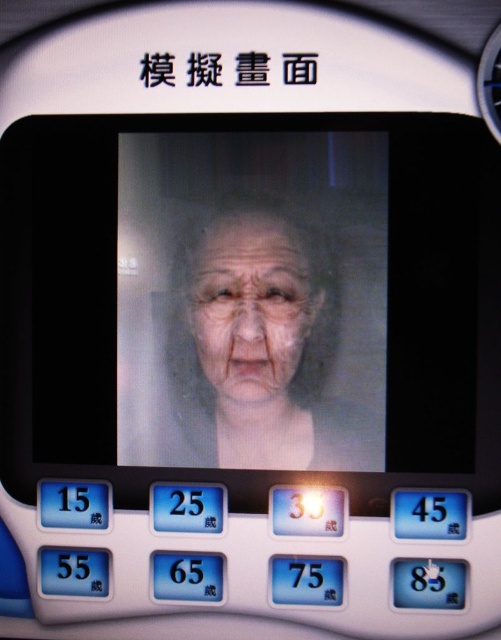
In the scene shown: You are a technician adjusting the display settings on a device. You notice a point at coordinates (256, 346) on the screen. Based on the scene description, what does this point likely represent?

The point at (256, 346) corresponds to the matte gray face at center, indicating it is the focal point of the displayed image for age estimation or identification purposes.

You are a technician examining a simulation screen that shows two faces. The first is a matte gray face at center and the second is a smooth skin face at center. Which face is located to the left?

The matte gray face at center is positioned on the left side of the smooth skin face at center, so the matte gray face at center is on the left.